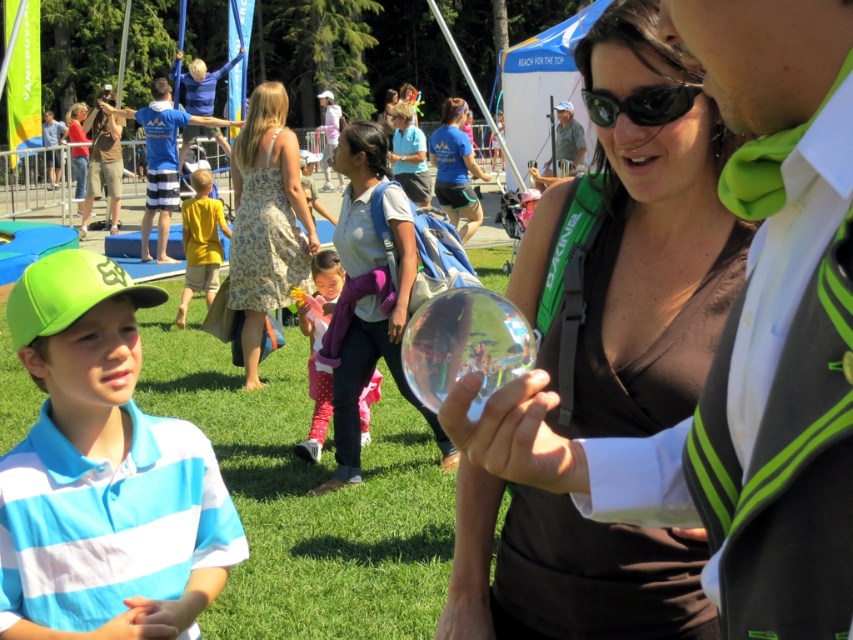
You are a photographer at the event and want to ensure both the matte gray shirt at center and the floral dress at center are clearly visible in your photo. Given their sizes, which one might you need to adjust your focus settings for to ensure clarity?

The matte gray shirt at center is larger in size than the floral dress at center, so you might need to adjust focus settings for the larger matte gray shirt at center to ensure clarity.